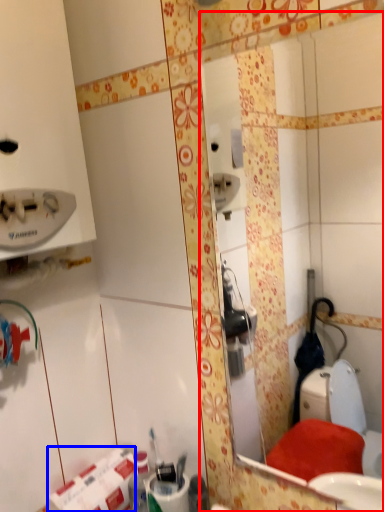
Question: Which object is closer to the camera taking this photo, mirror (highlighted by a red box) or toilet paper (highlighted by a blue box)?

Choices:
 (A) mirror
 (B) toilet paper

Answer: (A)